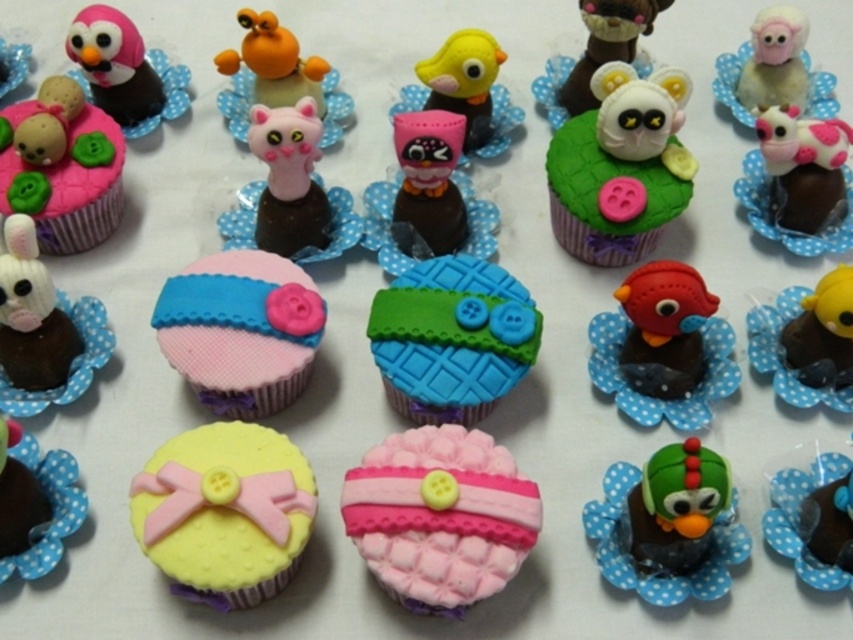
Question: Which object is the farthest from the yellow matte cupcake at center-left?

Choices:
 (A) green matte bird at center
 (B) green matte bird at lower right

Answer: (B)

Question: Can you confirm if pink quilted fabric cupcake at center is positioned to the left of pink matte cupcake at center-left?

Choices:
 (A) yes
 (B) no

Answer: (B)

Question: Observing the image, what is the correct spatial positioning of pink quilted fabric cupcake at center in reference to white matte rabbit at lower left?

Choices:
 (A) right
 (B) left

Answer: (A)

Question: Which object is the farthest from the pink matte cupcake at center-left?

Choices:
 (A) pink matte cat at center
 (B) pink glossy cow at upper right
 (C) matte brown teddy bear at upper right
 (D) yellow matte bird at center right

Answer: (B)

Question: From the image, what is the correct spatial relationship of matte pink plush owl at center in relation to pink matte sheep at upper right?

Choices:
 (A) right
 (B) left

Answer: (B)

Question: Which point is farther to the camera?

Choices:
 (A) tap(254, 113)
 (B) tap(810, 532)
 (C) tap(61, 106)
 (D) tap(793, 49)

Answer: (D)